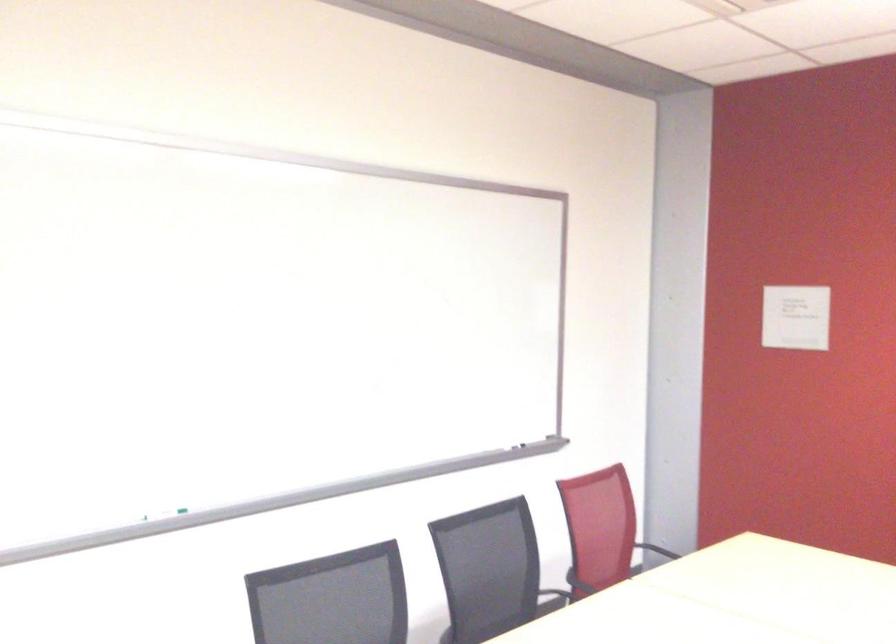
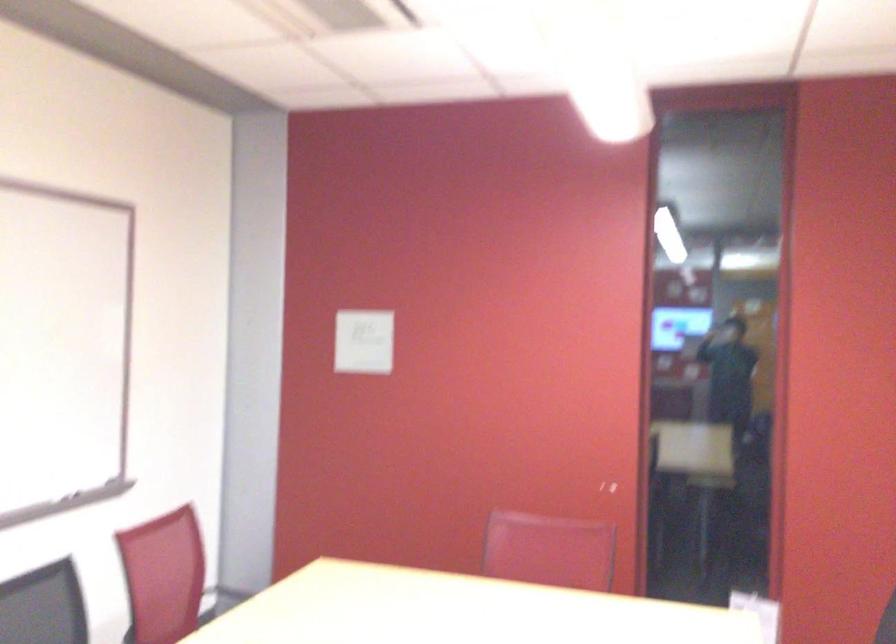
In a continuous first-person perspective shot, in which direction is the camera moving?

The cameraman moved toward right, forward.